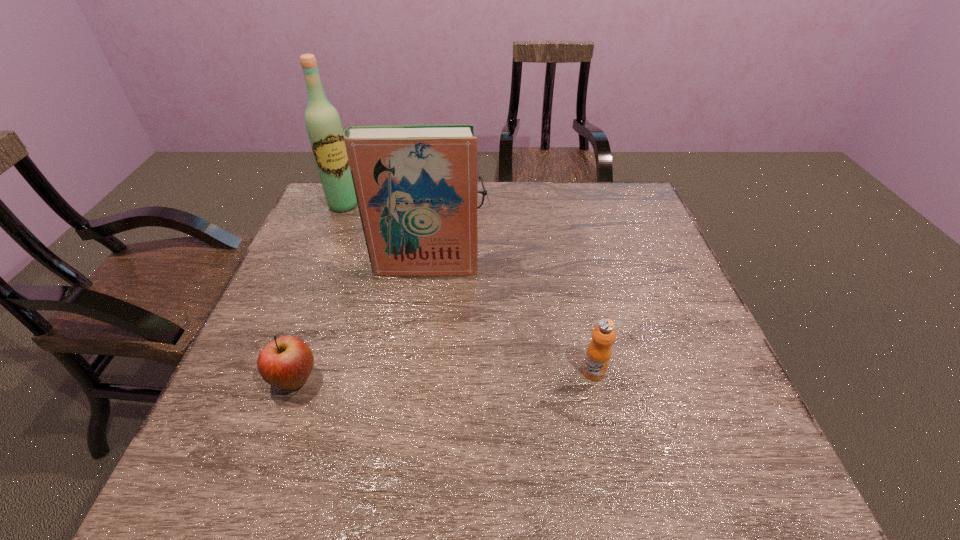
I want to click on free space located on the cover of the third farthest object, so click(x=416, y=368).

The image size is (960, 540). Identify the location of vacant area situated on the cover of the third farthest object. (411, 415).

This screenshot has width=960, height=540. I want to click on blank space located on the front-facing side of the shortest object, so click(475, 299).

Find the location of a particular element. This screenshot has height=540, width=960. free region located on the front-facing side of the shortest object is located at coordinates (466, 251).

Where is `free spot located on the front-facing side of the shortest object`? free spot located on the front-facing side of the shortest object is located at coordinates (468, 260).

The height and width of the screenshot is (540, 960). Find the location of `free spot located on the front-facing side of the wine bottle`. free spot located on the front-facing side of the wine bottle is located at coordinates (405, 288).

Locate an element on the screen. This screenshot has width=960, height=540. blank area located 0.050m on the front-facing side of the wine bottle is located at coordinates (354, 220).

At what (x,y) coordinates should I click in order to perform the action: click on free point located 0.210m on the front-facing side of the wine bottle. Please return your answer as a coordinate pair (x, y). This screenshot has width=960, height=540. Looking at the image, I should click on (375, 248).

Where is `spectacles that is at the far edge`? spectacles that is at the far edge is located at coordinates (484, 193).

Where is `wine bottle present at the far edge`? This screenshot has height=540, width=960. wine bottle present at the far edge is located at coordinates (323, 124).